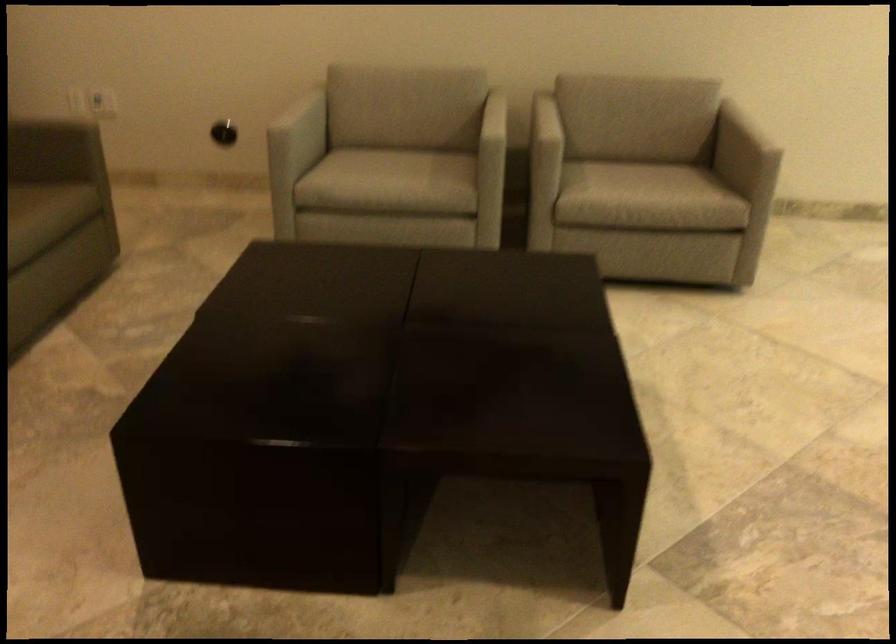
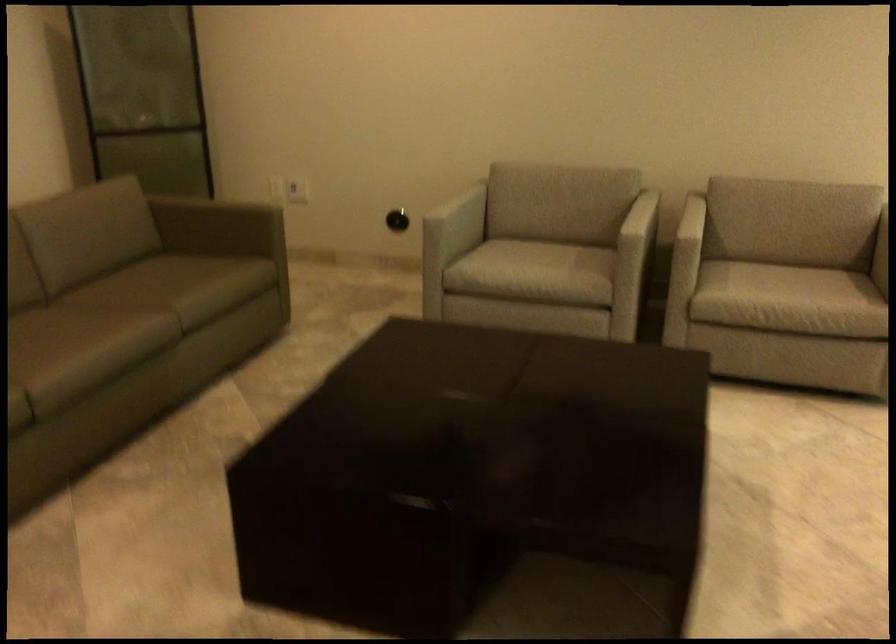
Question: The camera is either moving clockwise (left) or counter-clockwise (right) around the object. The first image is from the beginning of the video and the second image is from the end. Is the camera moving left or right when shooting the video?

Choices:
 (A) Left
 (B) Right

Answer: (B)